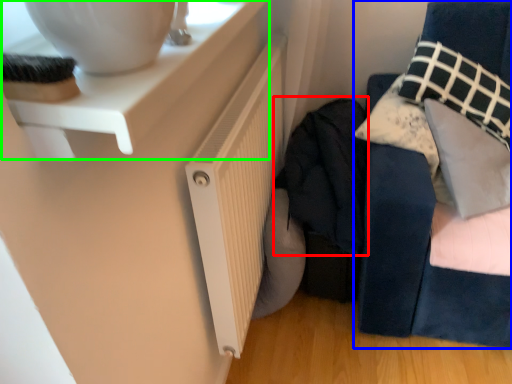
Question: Which object is the closest to the clothing (highlighted by a red box)? Choose among these: furniture (highlighted by a blue box) or table (highlighted by a green box).

Choices:
 (A) furniture
 (B) table

Answer: (A)